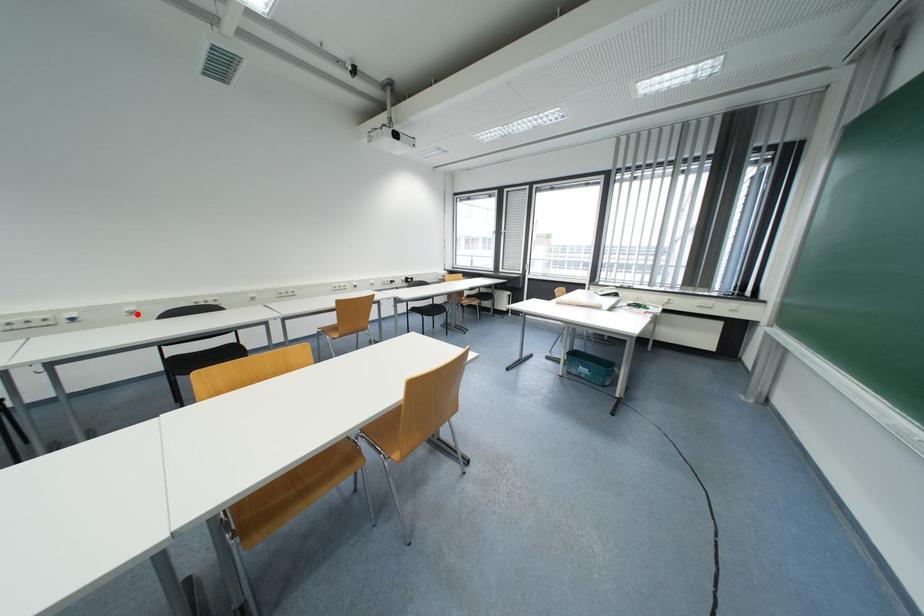
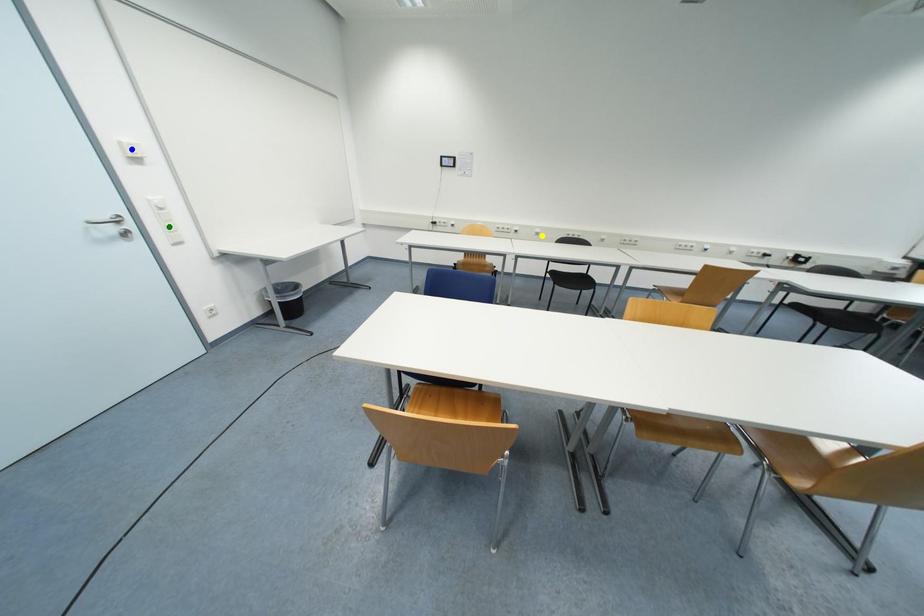
Question: I am providing you with two images of the same scene from different viewpoints. A red point is marked on the first image. You are given multiple points on the second image. Which spot in image 2 lines up with the point in image 1?

Choices:
 (A) blue point
 (B) green point
 (C) yellow point

Answer: (C)